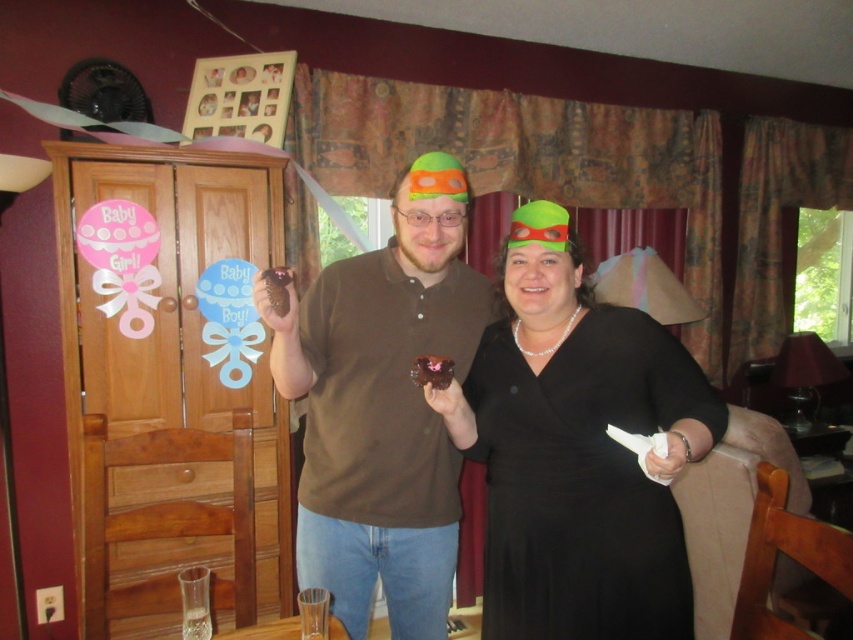
Question: From the image, what is the correct spatial relationship of brown matte shirt at center in relation to chocolate cake at center?

Choices:
 (A) above
 (B) below

Answer: (B)

Question: Which point is farther to the camera?

Choices:
 (A) (426, 157)
 (B) (265, 273)
 (C) (560, 426)

Answer: (A)

Question: Which of the following is the farthest from the observer?

Choices:
 (A) click(x=537, y=445)
 (B) click(x=415, y=376)

Answer: (B)

Question: Is brown matte shirt at center smaller than chocolate cake at center?

Choices:
 (A) yes
 (B) no

Answer: (B)

Question: Is chocolate cake at center further to camera compared to brown matte cupcake at center?

Choices:
 (A) yes
 (B) no

Answer: (A)

Question: Which point is farther to the camera?

Choices:
 (A) brown matte shirt at center
 (B) black satin dress at center
 (C) chocolate cake at center
 (D) brown matte cupcake at center

Answer: (C)